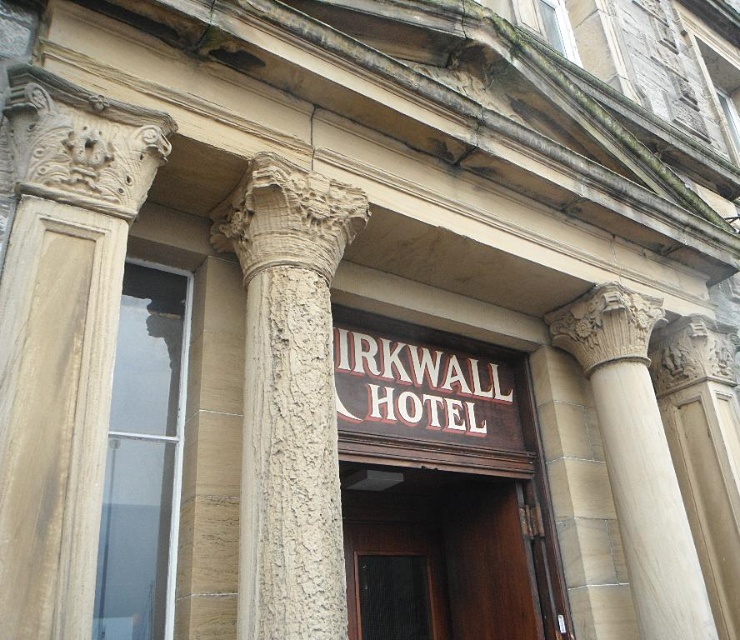
Question: Does beige stone column at left appear under brown wooden door at center?

Choices:
 (A) yes
 (B) no

Answer: (B)

Question: Is brown wooden door at center bigger than brown wooden sign at center?

Choices:
 (A) no
 (B) yes

Answer: (B)

Question: Does beige stone column at left have a smaller size compared to speckled stone column at center?

Choices:
 (A) no
 (B) yes

Answer: (B)

Question: Which point is farther from the camera taking this photo?

Choices:
 (A) pos(243,624)
 (B) pos(433,388)
 (C) pos(481,564)

Answer: (C)

Question: Which object is farther from the camera taking this photo?

Choices:
 (A) speckled stone column at center
 (B) brown wooden sign at center
 (C) beige stone column at left

Answer: (B)

Question: Which point appears closest to the camera in this image?

Choices:
 (A) (639, 486)
 (B) (423, 550)
 (C) (326, 205)

Answer: (C)